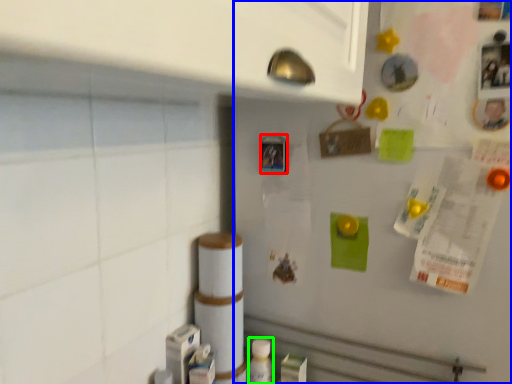
Question: Which object is positioned closest to button (highlighted by a red box)? Select from fridge (highlighted by a blue box) and bottle (highlighted by a green box).

Choices:
 (A) fridge
 (B) bottle

Answer: (A)